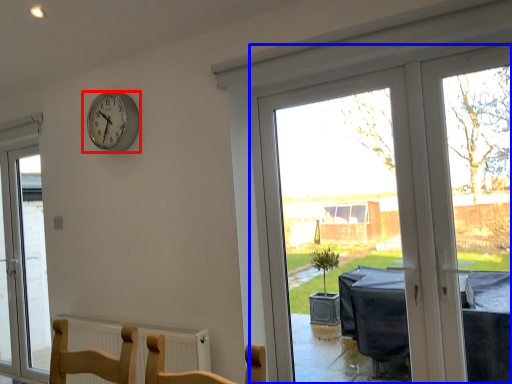
Question: Which object appears closest to the camera in this image, wall clock (highlighted by a red box) or window (highlighted by a blue box)?

Choices:
 (A) wall clock
 (B) window

Answer: (B)